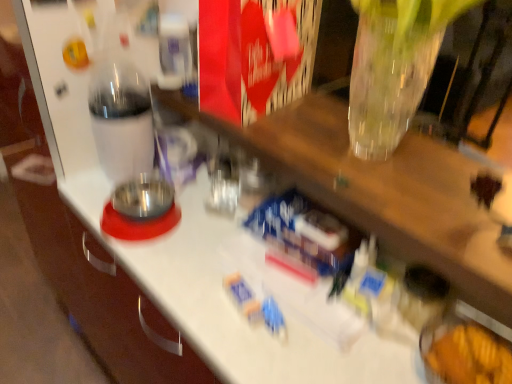
Question: Can you confirm if transparent plastic bottle at left is smaller than blue plastic toy at center, the 1th toy when ordered from bottom to top?

Choices:
 (A) no
 (B) yes

Answer: (A)

Question: Can you confirm if transparent plastic bottle at left is taller than blue plastic toy at center, the 1th toy when ordered from bottom to top?

Choices:
 (A) yes
 (B) no

Answer: (A)

Question: Is transparent plastic bottle at left positioned before blue plastic toy at center, the second toy when ordered from top to bottom?

Choices:
 (A) no
 (B) yes

Answer: (A)

Question: From a real-world perspective, is transparent plastic bottle at left positioned under blue plastic toy at center, the 1th toy when ordered from bottom to top, based on gravity?

Choices:
 (A) no
 (B) yes

Answer: (A)

Question: Is transparent plastic bottle at left wider than blue plastic toy at center, the second toy when ordered from top to bottom?

Choices:
 (A) no
 (B) yes

Answer: (B)

Question: Looking at their shapes, would you say blue plastic toy at center, the 1th toy when ordered from bottom to top, is wider or thinner than blue plastic toy at center, placed as the first toy when sorted from top to bottom?

Choices:
 (A) wide
 (B) thin

Answer: (B)

Question: From their relative heights in the image, would you say blue plastic toy at center, the second toy when ordered from top to bottom, is taller or shorter than blue plastic toy at center, arranged as the 2th toy when ordered from the bottom?

Choices:
 (A) tall
 (B) short

Answer: (B)

Question: In the image, is blue plastic toy at center, the 1th toy when ordered from bottom to top, on the left side or the right side of blue plastic toy at center, arranged as the 2th toy when ordered from the bottom?

Choices:
 (A) right
 (B) left

Answer: (B)

Question: Considering the positions of blue plastic toy at center, the 1th toy when ordered from bottom to top, and blue plastic toy at center, placed as the first toy when sorted from top to bottom, in the image, is blue plastic toy at center, the 1th toy when ordered from bottom to top, bigger or smaller than blue plastic toy at center, placed as the first toy when sorted from top to bottom,?

Choices:
 (A) small
 (B) big

Answer: (A)

Question: Visually, is blue plastic toy at center, placed as the first toy when sorted from top to bottom, positioned to the left or to the right of blue plastic toy at center, the 1th toy when ordered from bottom to top?

Choices:
 (A) right
 (B) left

Answer: (A)

Question: Looking at the image, does blue plastic toy at center, placed as the first toy when sorted from top to bottom, seem bigger or smaller compared to blue plastic toy at center, the 1th toy when ordered from bottom to top?

Choices:
 (A) big
 (B) small

Answer: (A)

Question: Considering the positions of blue plastic toy at center, arranged as the 2th toy when ordered from the bottom, and blue plastic toy at center, the 1th toy when ordered from bottom to top, in the image, is blue plastic toy at center, arranged as the 2th toy when ordered from the bottom, wider or thinner than blue plastic toy at center, the 1th toy when ordered from bottom to top,?

Choices:
 (A) thin
 (B) wide

Answer: (B)

Question: In the image, is blue plastic toy at center, arranged as the 2th toy when ordered from the bottom, positioned in front of or behind blue plastic toy at center, the second toy when ordered from top to bottom?

Choices:
 (A) behind
 (B) front

Answer: (A)

Question: From the image's perspective, relative to transparent plastic bottle at left, is blue plastic toy at center, the second toy when ordered from top to bottom, above or below?

Choices:
 (A) above
 (B) below

Answer: (B)

Question: Looking at their shapes, would you say blue plastic toy at center, the 1th toy when ordered from bottom to top, is wider or thinner than transparent plastic bottle at left?

Choices:
 (A) wide
 (B) thin

Answer: (B)